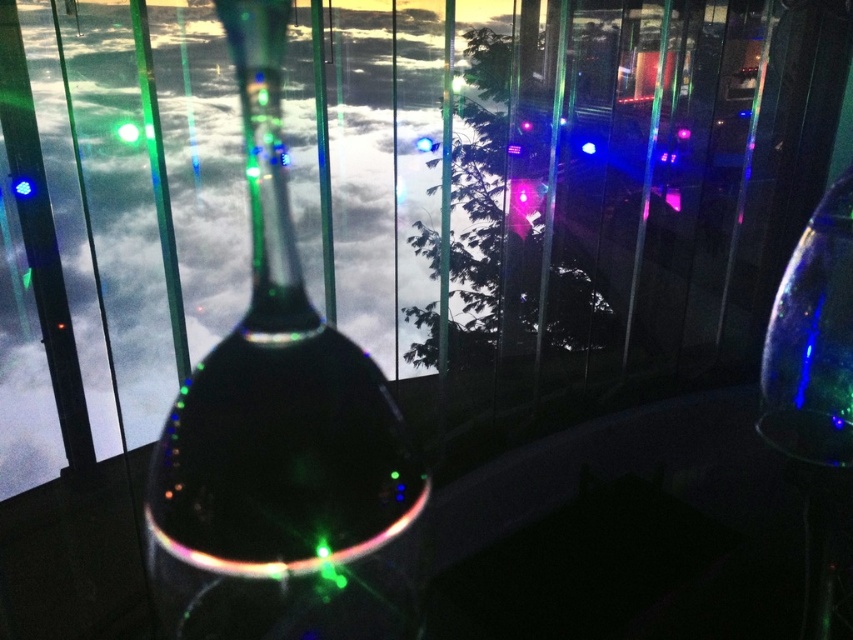
Does transparent glass bottle at center appear on the right side of green translucent light at center?

Yes, transparent glass bottle at center is to the right of green translucent light at center.

Can you confirm if transparent glass bottle at center is wider than green translucent light at center?

Correct, the width of transparent glass bottle at center exceeds that of green translucent light at center.

In order to click on transparent glass bottle at center in this screenshot , I will do `click(282, 436)`.

Between transparent glass bottle at center and transparent glass wine glass at right, which one appears on the left side from the viewer's perspective?

transparent glass bottle at center is more to the left.

In the scene shown: Is transparent glass bottle at center further to the viewer compared to transparent glass wine glass at right?

Yes, transparent glass bottle at center is behind transparent glass wine glass at right.

This screenshot has width=853, height=640. In order to click on transparent glass bottle at center in this screenshot , I will do `click(282, 436)`.

Between point (822, 632) and point (134, 132), which one is positioned behind?

Positioned behind is point (134, 132).

Who is more distant from viewer, (834, 467) or (126, 141)?

Point (126, 141)

I want to click on transparent glass wine glass at right, so click(814, 388).